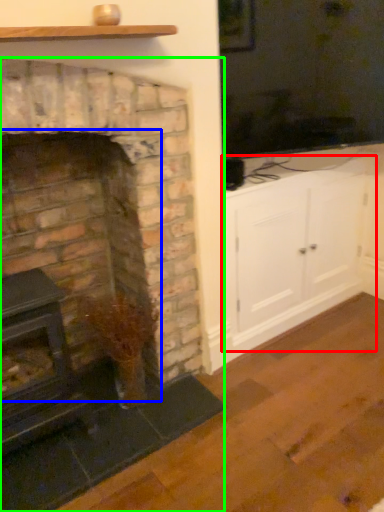
Question: Which is farther away from entertainment center (highlighted by a red box)? fireplace (highlighted by a blue box) or fireplace (highlighted by a green box)?

Choices:
 (A) fireplace
 (B) fireplace

Answer: (A)